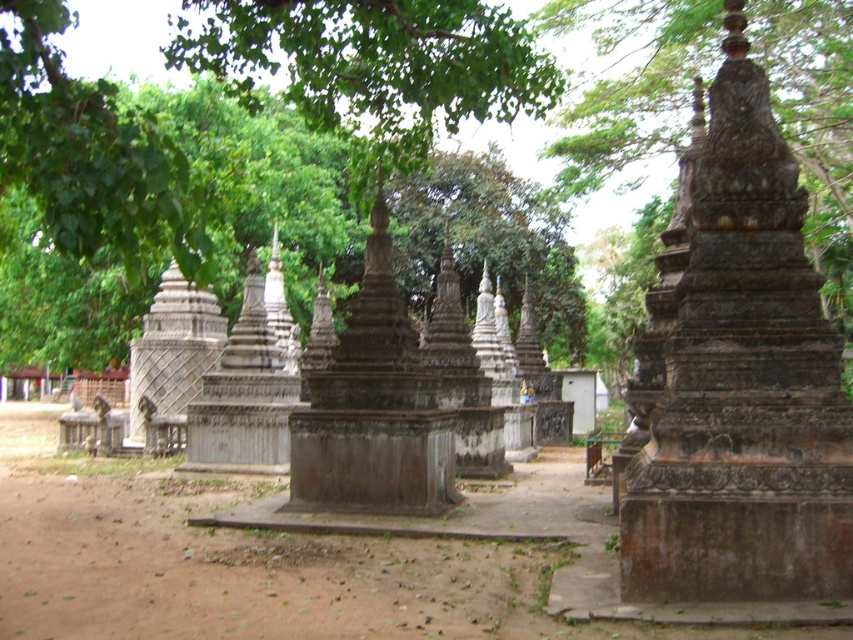
Question: Which of the following is the closest to the observer?

Choices:
 (A) (659, 444)
 (B) (119, 632)

Answer: (B)

Question: Where is gray stone stupa at center located in relation to brown dirt field at center in the image?

Choices:
 (A) left
 (B) right

Answer: (B)

Question: Is gray stone stupa at center positioned behind brown dirt field at center?

Choices:
 (A) no
 (B) yes

Answer: (B)

Question: Is gray stone stupa at center positioned before brown dirt field at center?

Choices:
 (A) no
 (B) yes

Answer: (A)

Question: Which of the following is the farthest from the observer?

Choices:
 (A) (9, 522)
 (B) (842, 432)

Answer: (A)